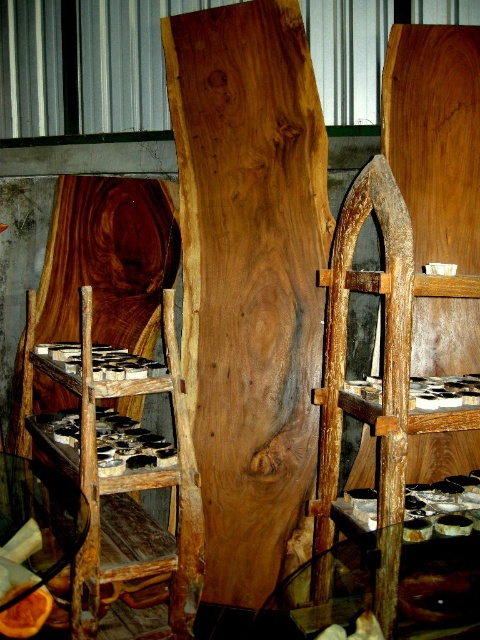
You are a carpenter planning to move the natural wood plank at center and the rustic wood ladder at center to a storage area. Which object should you move first if you want to place the larger item closer to the entrance?

You should move the natural wood plank at center first because it is smaller than the rustic wood ladder at center, allowing you to place the larger ladder closer to the entrance afterward.

You are taking a photo of the workshop and want to ensure both point (91,362) and point (385,516) are in focus. Which point should you focus on first to ensure the closest object is sharp?

You should focus on point (91,362) first because it is closer to the camera than point (385,516), ensuring the closest object is sharp.

Based on the scene description, where is the natural wood plank at center located in terms of its 2D coordinates?

The natural wood plank at center is located at the 2D coordinates of point (x=250, y=280).